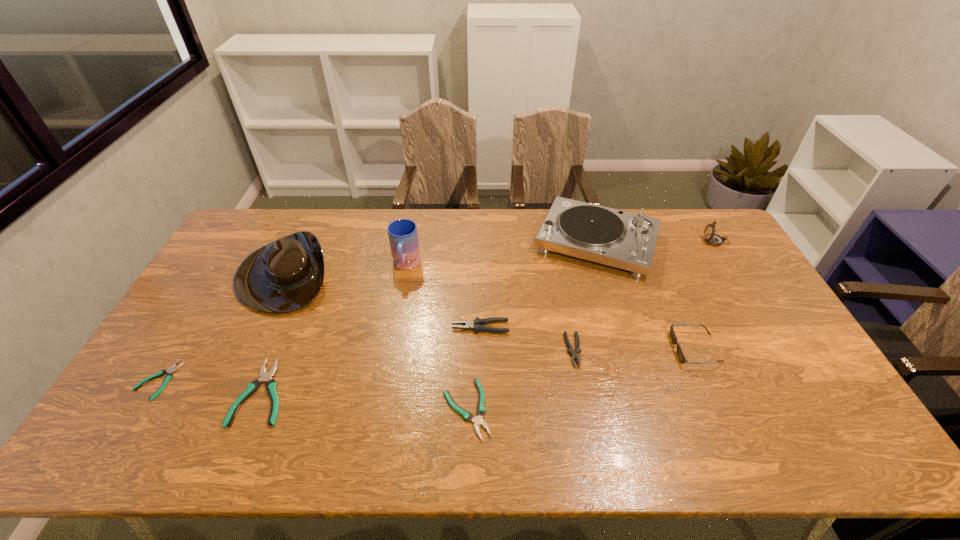
Where is `free location located 0.250m on the back of the third shortest object`? The height and width of the screenshot is (540, 960). free location located 0.250m on the back of the third shortest object is located at coordinates (302, 294).

Find the location of `vacant area situated on the back of the fourth tallest pliers`. vacant area situated on the back of the fourth tallest pliers is located at coordinates (468, 322).

Identify the location of free region located 0.050m on the right of the shortest pliers. This screenshot has height=540, width=960. (195, 380).

What are the coordinates of `record player situated at the far edge` in the screenshot? It's located at (621, 239).

Locate an element on the screen. The width and height of the screenshot is (960, 540). compass that is at the far edge is located at coordinates (711, 238).

Image resolution: width=960 pixels, height=540 pixels. I want to click on cowboy hat that is at the far edge, so click(x=283, y=276).

The image size is (960, 540). In order to click on cowboy hat situated at the left edge in this screenshot , I will do `click(283, 276)`.

Where is `pliers that is positioned at the left edge`? pliers that is positioned at the left edge is located at coordinates (171, 369).

Identify the location of object located in the right edge section of the desktop. (711, 238).

You are a GUI agent. You are given a task and a screenshot of the screen. Output one action in this format:
    pyautogui.click(x=<x>, y=<y>)
    Task: Click on the object located in the far left corner section of the desktop
    Image resolution: width=960 pixels, height=540 pixels.
    Given the screenshot: What is the action you would take?
    pyautogui.click(x=283, y=276)